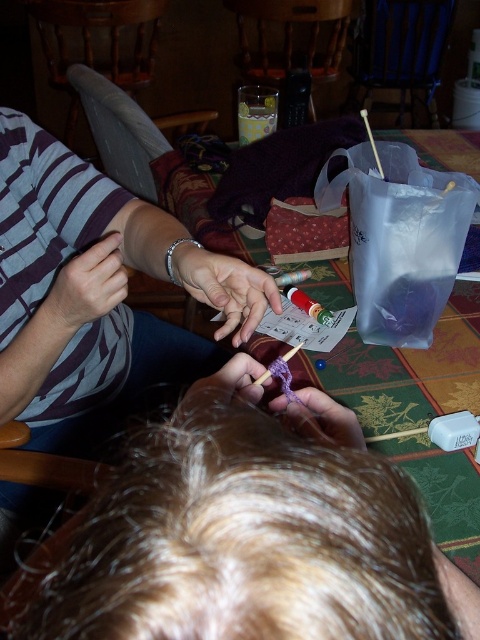
Who is positioned more to the left, blonde hair at center or silver metallic bracelet at center?

Positioned to the left is silver metallic bracelet at center.

Who is more forward, (241, 381) or (225, 310)?

Point (241, 381)

Measure the distance between point [256,467] and camera.

Point [256,467] and camera are 9.62 inches apart from each other.

This screenshot has height=640, width=480. Identify the location of blonde hair at center. (251, 538).

Can you confirm if green fabric table at center is positioned above purple yarn at center?

Indeed, green fabric table at center is positioned over purple yarn at center.

Which is below, green fabric table at center or purple yarn at center?

Positioned lower is purple yarn at center.

Does point (336, 356) come behind point (301, 401)?

Yes.

Find the location of a particular element. This screenshot has height=640, width=480. green fabric table at center is located at coordinates [x=404, y=371].

Who is positioned more to the right, striped fabric shirt at left or transparent plastic bag at upper right?

From the viewer's perspective, transparent plastic bag at upper right appears more on the right side.

Which is behind, point (72, 376) or point (389, 208)?

The point (72, 376) is more distant.

At what (x,y) coordinates should I click in order to perform the action: click on striped fabric shirt at left. Please return your answer as a coordinate pair (x, y). This screenshot has height=640, width=480. Looking at the image, I should click on (96, 284).